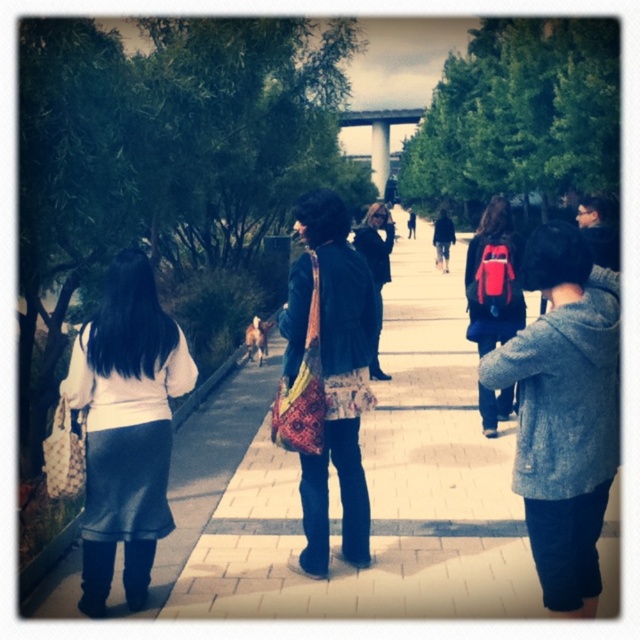
You are a photographer standing at the start of the pathway. You want to take a photo that includes both the patterned fabric bag at center and the white concrete pillar at center. Which object will appear smaller in the photo?

The patterned fabric bag at center will appear smaller in the photo because it has a lesser height compared to the white concrete pillar at center.

Consider the image. You are standing at the starting point of the pathway and see the point marked at coordinates (493, 278). What object is located at that point?

The point at coordinates (493, 278) marks the location of the matte red backpack at center right.